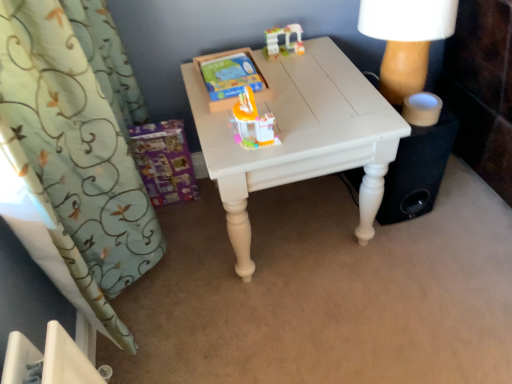
This screenshot has height=384, width=512. Identify the location of free point below white painted wood table at center (from a real-world perspective). (298, 230).